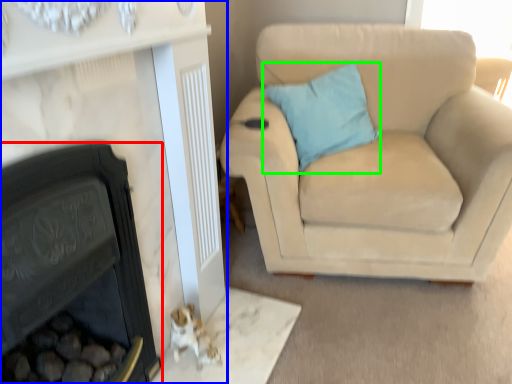
Question: Based on their relative distances, which object is farther from fireplace (highlighted by a red box)? Choose from fireplace (highlighted by a blue box) and pillow (highlighted by a green box).

Choices:
 (A) fireplace
 (B) pillow

Answer: (B)